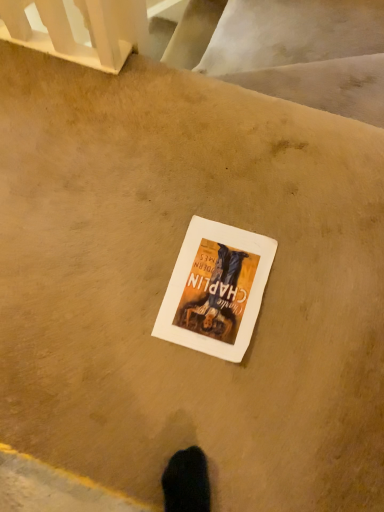
I want to click on empty space that is ontop of white paper at center (from a real-world perspective), so (x=214, y=282).